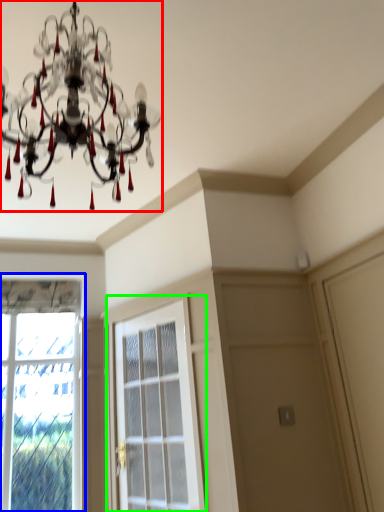
Question: Considering the real-world distances, which object is farthest from lamp (highlighted by a red box)? window (highlighted by a blue box) or screen door (highlighted by a green box)?

Choices:
 (A) window
 (B) screen door

Answer: (A)